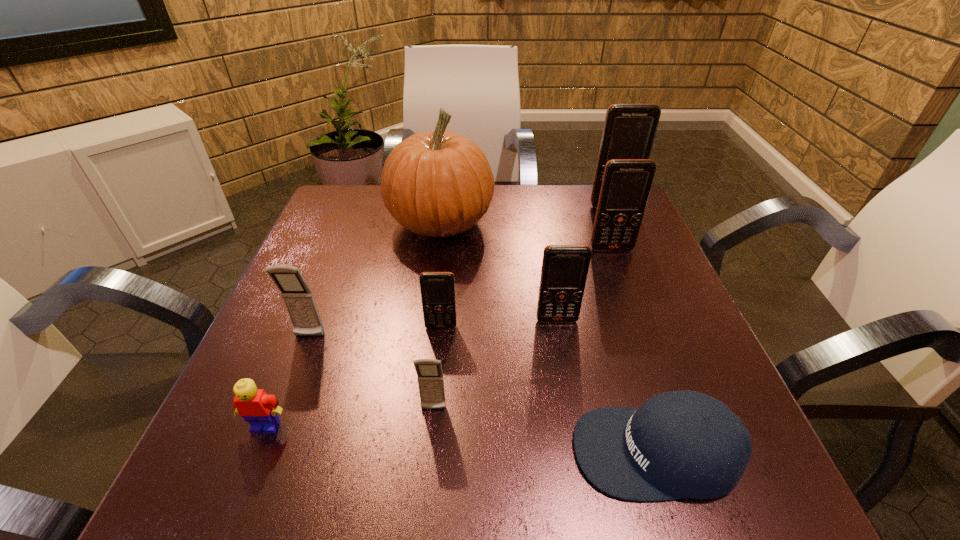
Locate an element on the screen. This screenshot has height=540, width=960. vacant space that is in between the leftmost cellular telephone and the nearest cellular telephone is located at coordinates (372, 373).

Where is `free space between the right gray cellular telephone and the second smallest orange cellular telephone`? free space between the right gray cellular telephone and the second smallest orange cellular telephone is located at coordinates (495, 364).

Image resolution: width=960 pixels, height=540 pixels. Find the location of `free space between the blue baseball cap and the leftmost orange cellular telephone`. free space between the blue baseball cap and the leftmost orange cellular telephone is located at coordinates (549, 389).

The width and height of the screenshot is (960, 540). I want to click on object that is the eighth closest to the leftmost orange cellular telephone, so click(x=629, y=131).

Select which object appears as the eighth closest to the farthest orange cellular telephone. Please provide its 2D coordinates. Your answer should be formatted as a tuple, i.e. [(x, y)], where the tuple contains the x and y coordinates of a point satisfying the conditions above.

[(256, 407)]

What are the coordinates of `the sixth closest cellular telephone to the pumpkin` in the screenshot? It's located at (430, 378).

Identify which cellular telephone is the third closest to the baseball cap. Please provide its 2D coordinates. Your answer should be formatted as a tuple, i.e. [(x, y)], where the tuple contains the x and y coordinates of a point satisfying the conditions above.

[(437, 288)]

Where is `orange cellular telephone that is the third closest to the bigger gray cellular telephone`? This screenshot has height=540, width=960. orange cellular telephone that is the third closest to the bigger gray cellular telephone is located at coordinates (626, 184).

The width and height of the screenshot is (960, 540). I want to click on the fourth closest orange cellular telephone to the right gray cellular telephone, so click(x=629, y=131).

The image size is (960, 540). In order to click on free space that satisfies the following two spatial constraints: 1. on the stem of the pumpkin; 2. on the front-facing side of the Lego in this screenshot , I will do `click(417, 426)`.